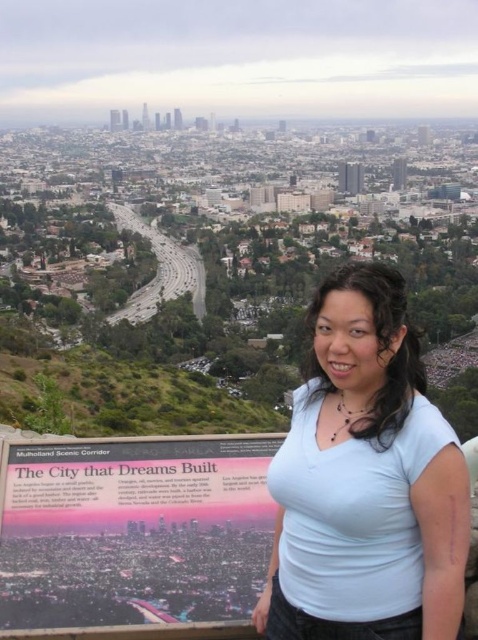
Question: Which of the following is the closest to the observer?

Choices:
 (A) light blue fabric at center
 (B) pink paper sign at center

Answer: (A)

Question: Is the position of light blue fabric at center less distant than that of pink paper sign at center?

Choices:
 (A) no
 (B) yes

Answer: (B)

Question: Is light blue fabric at center wider than pink paper sign at center?

Choices:
 (A) yes
 (B) no

Answer: (B)

Question: Which of the following is the closest to the observer?

Choices:
 (A) light blue fabric at center
 (B) pink paper sign at center

Answer: (A)

Question: Does light blue fabric at center have a smaller size compared to pink paper sign at center?

Choices:
 (A) yes
 (B) no

Answer: (B)

Question: Which point is farther to the camera?

Choices:
 (A) light blue fabric at center
 (B) pink paper sign at center

Answer: (B)